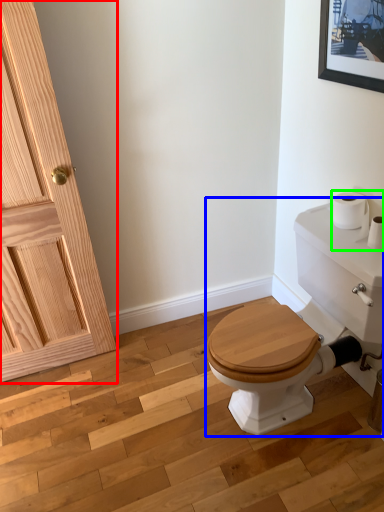
Question: Which object is positioned closest to door (highlighted by a red box)? Select from porcelain (highlighted by a blue box) and toilet paper (highlighted by a green box).

Choices:
 (A) porcelain
 (B) toilet paper

Answer: (A)